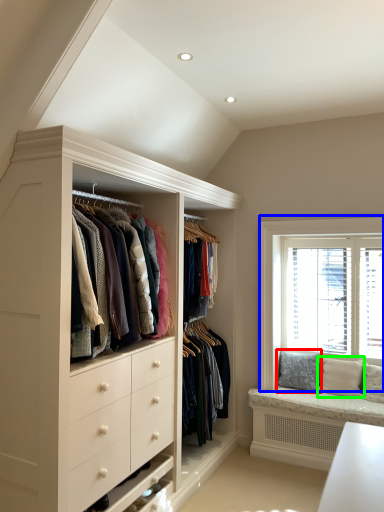
Question: Considering the real-world distances, which object is farthest from pillow (highlighted by a red box)? window (highlighted by a blue box) or pillow (highlighted by a green box)?

Choices:
 (A) window
 (B) pillow

Answer: (A)